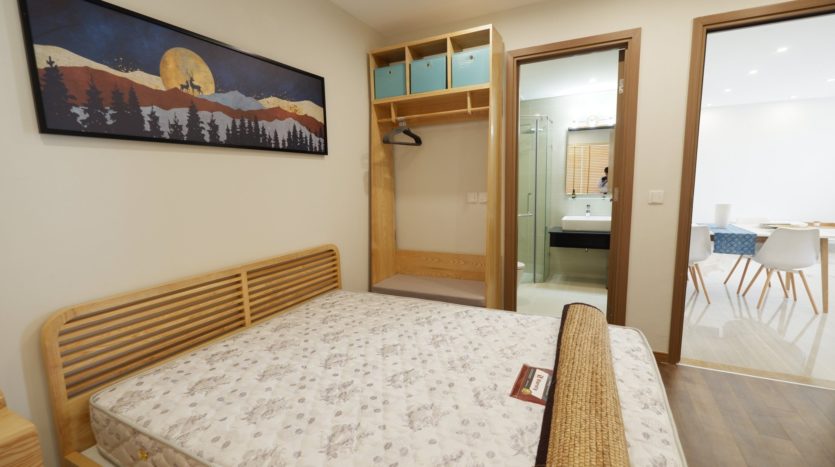
This screenshot has width=835, height=467. I want to click on dining chairs, so click(777, 253), click(746, 218), click(691, 248).